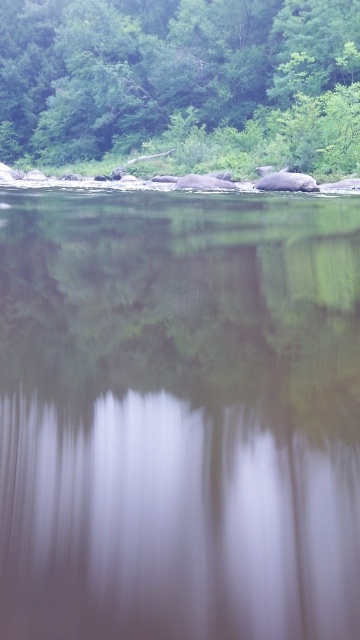
Which is in front, point (102, 230) or point (150, 16)?

Point (102, 230) is in front.

Measure the distance between transparent glass lake at center and camera.

A distance of 6.96 meters exists between transparent glass lake at center and camera.

Which is behind, point (122, 493) or point (122, 16)?

Positioned behind is point (122, 16).

You are a GUI agent. You are given a task and a screenshot of the screen. Output one action in this format:
    pyautogui.click(x=<x>, y=<y>)
    Task: Click on the transparent glass lake at center
    
    Given the screenshot: What is the action you would take?
    pyautogui.click(x=178, y=417)